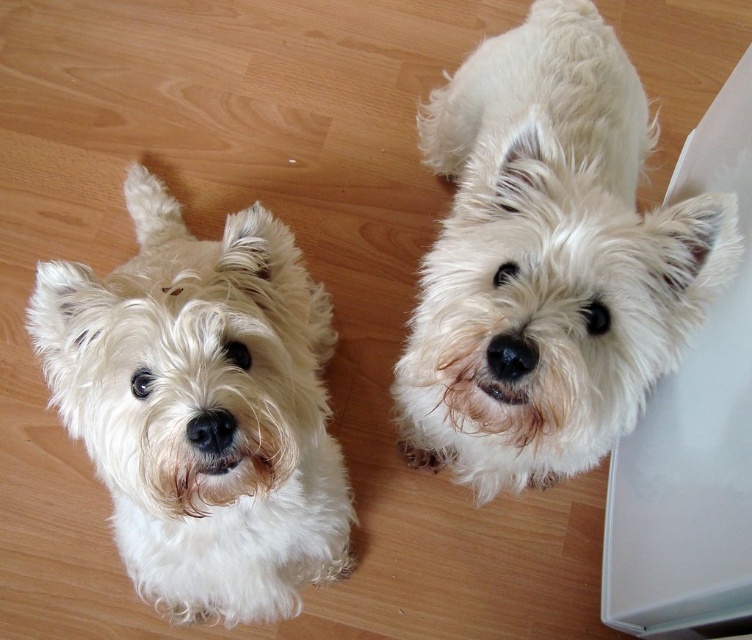
From the picture: Is white fluffy dog at upper center taller than white fluffy dog at center?

Yes, white fluffy dog at upper center is taller than white fluffy dog at center.

Who is positioned more to the right, white fluffy dog at upper center or white fluffy dog at center?

Positioned to the right is white fluffy dog at upper center.

Is point (475, 272) less distant than point (308, 381)?

Yes, it is.

Identify the location of white fluffy dog at upper center. (547, 259).